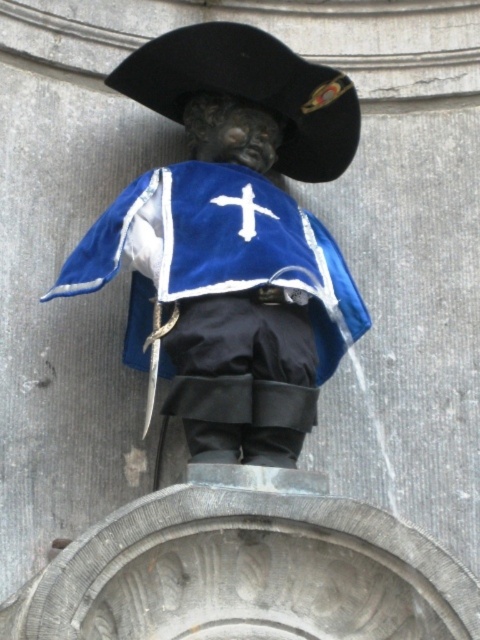
Based on the photo, between velvet blue cape at center and black felt hat at upper center, which one appears on the left side from the viewer's perspective?

velvet blue cape at center is more to the left.

Is velvet blue cape at center to the left of black felt hat at upper center from the viewer's perspective?

Indeed, velvet blue cape at center is positioned on the left side of black felt hat at upper center.

Describe the element at coordinates (231, 241) in the screenshot. I see `velvet blue cape at center` at that location.

The image size is (480, 640). Find the location of `velvet blue cape at center`. velvet blue cape at center is located at coordinates (231, 241).